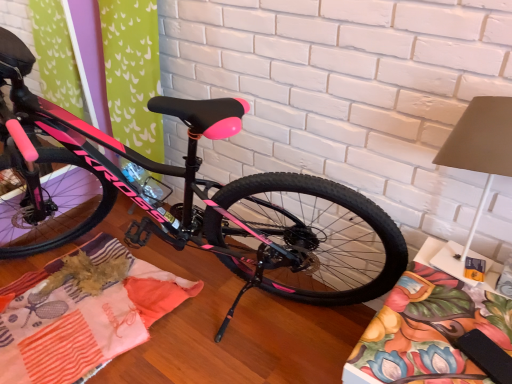
The height and width of the screenshot is (384, 512). I want to click on vacant region above patchwork fabric at center, which is counted as the second blanket, starting from the right (from a real-world perspective), so click(x=64, y=297).